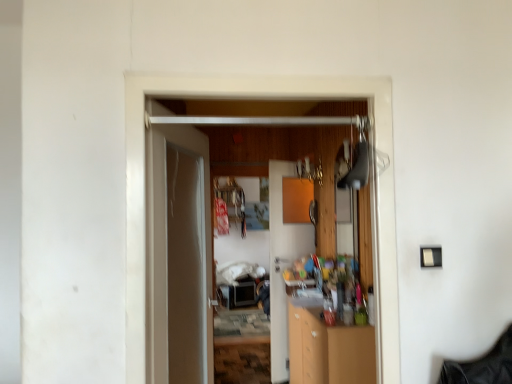
Question: In the image, is wooden door at center, marked as the 3th door in a back-to-front arrangement, on the left side or the right side of wooden cabinet at center, the 3th door from the front?

Choices:
 (A) left
 (B) right

Answer: (A)

Question: Is wooden door at center, arranged as the 1th door when viewed from the front, taller or shorter than wooden cabinet at center, which appears as the first door when viewed from the back?

Choices:
 (A) short
 (B) tall

Answer: (A)

Question: Which object is the closest to the wooden door at center, marked as the 3th door in a back-to-front arrangement?

Choices:
 (A) wooden cabinet at center, which appears as the first door when viewed from the back
 (B) wooden cabinet at center
 (C) white glossy door at center, the second door in the front-to-back sequence

Answer: (C)

Question: Considering the real-world distances, which object is closest to the wooden cabinet at center?

Choices:
 (A) wooden cabinet at center, the 3th door from the front
 (B) wooden door at center, marked as the 3th door in a back-to-front arrangement
 (C) white glossy door at center, the second door in the front-to-back sequence

Answer: (A)